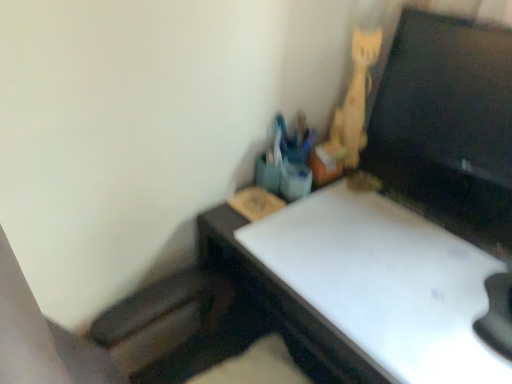
Measure the distance between point (503,32) and camera.

The depth of point (503,32) is 34.72 inches.

What do you see at coordinates (449, 94) in the screenshot? The width and height of the screenshot is (512, 384). I see `black glossy monitor at upper right` at bounding box center [449, 94].

What are the coordinates of `black glossy monitor at upper right` in the screenshot? It's located at (449, 94).

The width and height of the screenshot is (512, 384). What do you see at coordinates (354, 101) in the screenshot?
I see `wooden cat at upper right` at bounding box center [354, 101].

The height and width of the screenshot is (384, 512). Find the location of `wooden cat at upper right`. wooden cat at upper right is located at coordinates (354, 101).

Locate an element on the screen. black glossy monitor at upper right is located at coordinates (449, 94).

Considering the positions of objects black glossy monitor at upper right and wooden cat at upper right in the image provided, who is more to the right, black glossy monitor at upper right or wooden cat at upper right?

black glossy monitor at upper right is more to the right.

Consider the image. Is black glossy monitor at upper right further to the viewer compared to wooden cat at upper right?

No.

Is point (458, 20) closer to viewer compared to point (327, 147)?

Yes, it is.

Looking at this image, from the image's perspective, which one is positioned lower, black glossy monitor at upper right or wooden cat at upper right?

wooden cat at upper right, from the image's perspective.

From a real-world perspective, does black glossy monitor at upper right stand above wooden cat at upper right?

Correct, in the physical world, black glossy monitor at upper right is higher than wooden cat at upper right.

Is black glossy monitor at upper right thinner than wooden cat at upper right?

Indeed, black glossy monitor at upper right has a lesser width compared to wooden cat at upper right.

Is black glossy monitor at upper right taller or shorter than wooden cat at upper right?

Considering their sizes, black glossy monitor at upper right has less height than wooden cat at upper right.

Who is smaller, black glossy monitor at upper right or wooden cat at upper right?

Smaller between the two is wooden cat at upper right.

Is black glossy monitor at upper right spatially inside wooden cat at upper right, or outside of it?

black glossy monitor at upper right lies outside wooden cat at upper right.

Is there a large distance between black glossy monitor at upper right and wooden cat at upper right?

No, black glossy monitor at upper right is not far away from wooden cat at upper right.

Is black glossy monitor at upper right looking in the opposite direction of wooden cat at upper right?

No, black glossy monitor at upper right is not facing the opposite direction of wooden cat at upper right.

The image size is (512, 384). Find the location of `toy below the black glossy monitor at upper right (from a real-world perspective)`. toy below the black glossy monitor at upper right (from a real-world perspective) is located at coordinates (354, 101).

Between wooden cat at upper right and black glossy monitor at upper right, which one appears on the right side from the viewer's perspective?

Positioned to the right is black glossy monitor at upper right.

Does wooden cat at upper right come behind black glossy monitor at upper right?

Yes, it is behind black glossy monitor at upper right.

Considering the points (349, 110) and (408, 35), which point is in front, point (349, 110) or point (408, 35)?

The point (408, 35) is closer to the camera.

From the image's perspective, does wooden cat at upper right appear higher than black glossy monitor at upper right?

No, from the image's perspective, wooden cat at upper right is not on top of black glossy monitor at upper right.

From a real-world perspective, which object rests below the other?

From a 3D spatial view, wooden cat at upper right is below.

Considering the sizes of objects wooden cat at upper right and black glossy monitor at upper right in the image provided, who is wider, wooden cat at upper right or black glossy monitor at upper right?

With larger width is wooden cat at upper right.

Who is taller, wooden cat at upper right or black glossy monitor at upper right?

wooden cat at upper right.

Which of these two, wooden cat at upper right or black glossy monitor at upper right, is bigger?

black glossy monitor at upper right is bigger.

Can black glossy monitor at upper right be found inside wooden cat at upper right?

Definitely not — black glossy monitor at upper right is not inside wooden cat at upper right.

Would you consider wooden cat at upper right to be distant from black glossy monitor at upper right?

Actually, wooden cat at upper right and black glossy monitor at upper right are a little close together.

From the picture: Is wooden cat at upper right facing towards black glossy monitor at upper right?

No, wooden cat at upper right is not oriented towards black glossy monitor at upper right.

In the scene shown: How different are the orientations of wooden cat at upper right and black glossy monitor at upper right in degrees?

They differ by 34 degrees in their facing directions.

At what (x,y) coordinates should I click in order to perform the action: click on computer monitor that is above the wooden cat at upper right (from the image's perspective). Please return your answer as a coordinate pair (x, y). The width and height of the screenshot is (512, 384). Looking at the image, I should click on point(449,94).

Image resolution: width=512 pixels, height=384 pixels. Identify the location of toy located below the black glossy monitor at upper right (from the image's perspective). (354, 101).

You are a GUI agent. You are given a task and a screenshot of the screen. Output one action in this format:
    pyautogui.click(x=<x>, y=<y>)
    Task: Click on the toy on the left of black glossy monitor at upper right
    The height and width of the screenshot is (384, 512).
    Given the screenshot: What is the action you would take?
    pyautogui.click(x=354, y=101)